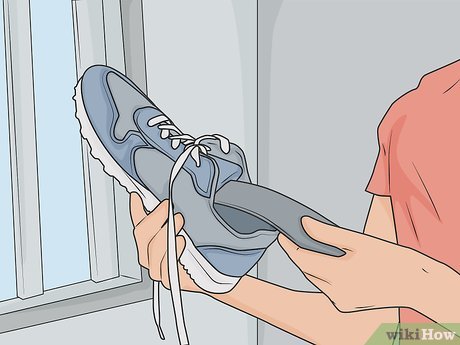
Locate an element on the screen. The width and height of the screenshot is (460, 345). chest is located at coordinates (438, 177).